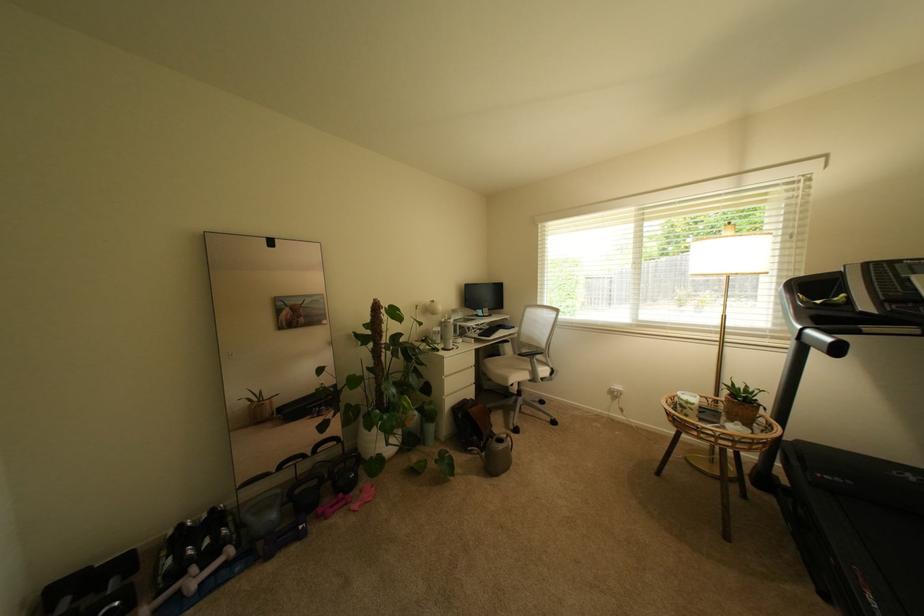
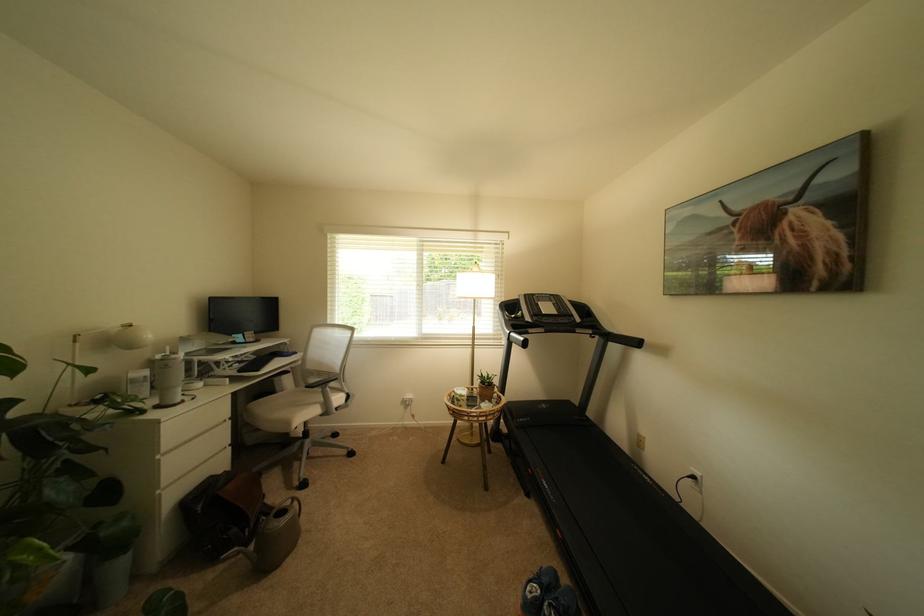
Question: The camera is either moving clockwise (left) or counter-clockwise (right) around the object. The first image is from the beginning of the video and the second image is from the end. Is the camera moving left or right when shooting the video?

Choices:
 (A) Left
 (B) Right

Answer: (A)